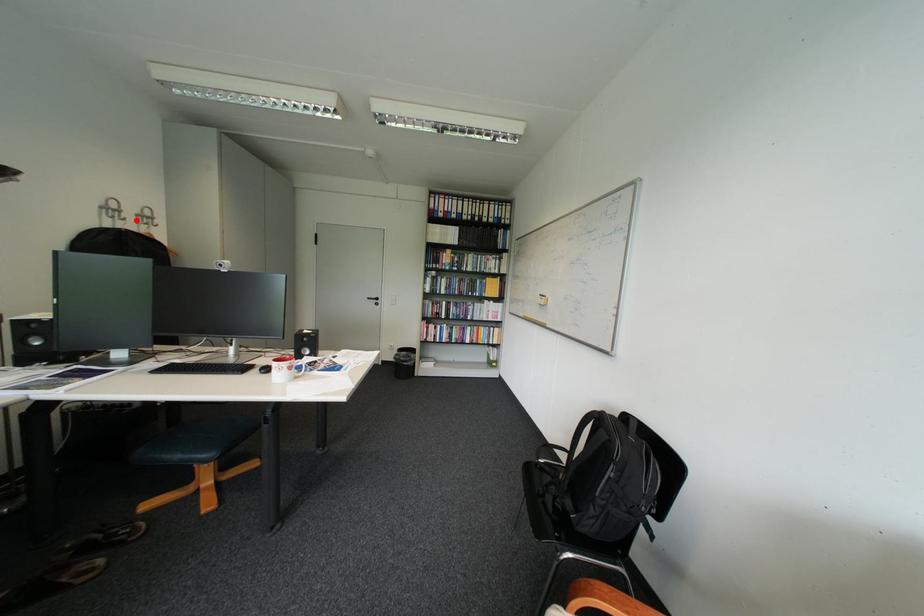
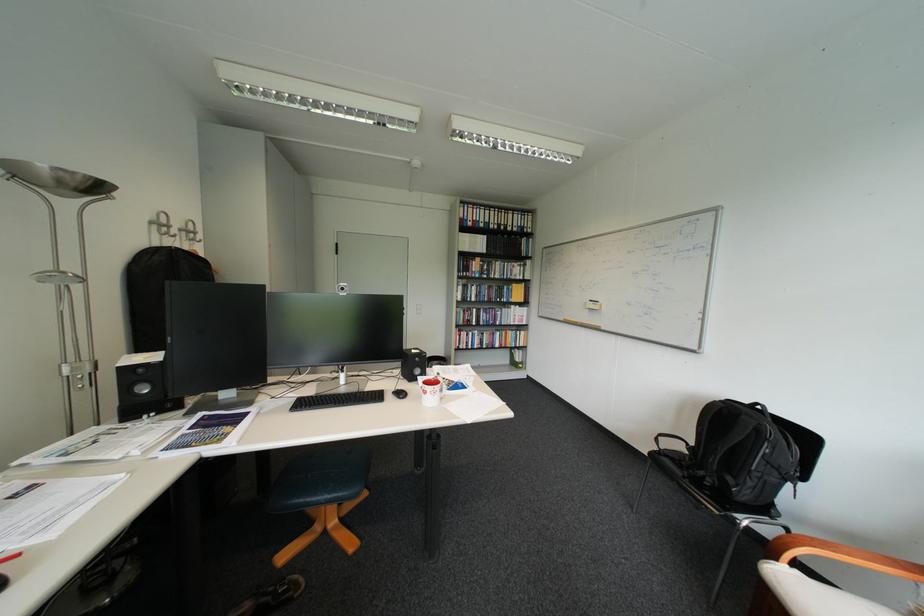
Where in the second image is the point corresponding to the highlighted location from the first image?

(187, 237)